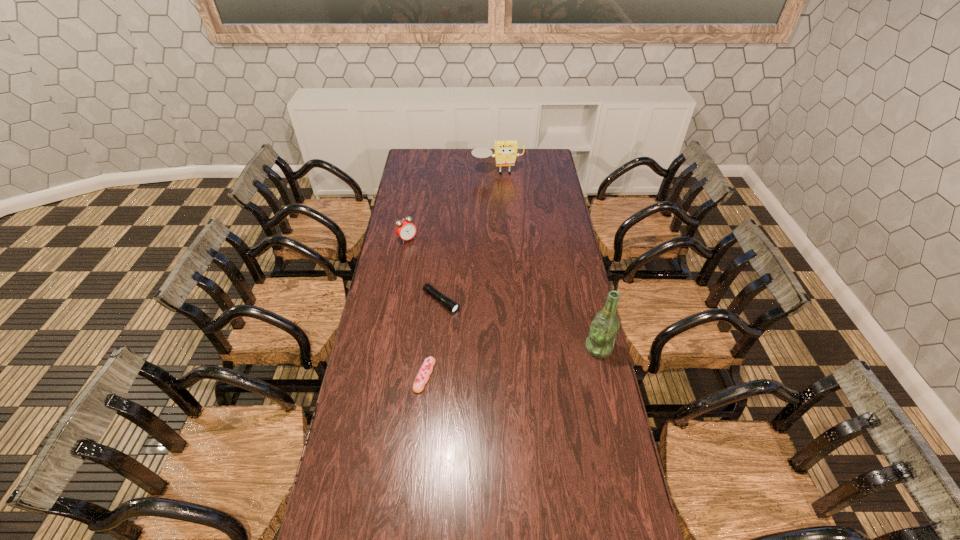
At what (x,y) coordinates should I click in order to perform the action: click on eclair. Please return your answer as a coordinate pair (x, y). The height and width of the screenshot is (540, 960). Looking at the image, I should click on (426, 369).

Locate an element on the screen. This screenshot has width=960, height=540. the rightmost object is located at coordinates (603, 330).

Locate an element on the screen. This screenshot has height=540, width=960. beer bottle is located at coordinates [603, 330].

I want to click on flashlight, so click(452, 306).

This screenshot has width=960, height=540. What are the coordinates of `alarm clock` in the screenshot? It's located at (405, 229).

Locate an element on the screen. the second farthest object is located at coordinates (405, 229).

What are the coordinates of `the farthest object` in the screenshot? It's located at (505, 154).

Find the location of a particular element. The image size is (960, 540). sponge is located at coordinates (505, 154).

Identify the location of vacant space located on the left of the eclair. Image resolution: width=960 pixels, height=540 pixels. (356, 375).

This screenshot has height=540, width=960. In order to click on vacant space located on the surface of the rightmost object in this screenshot , I will do `click(483, 348)`.